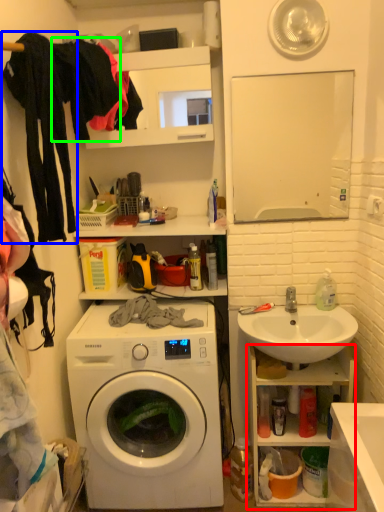
Question: Based on their relative distances, which object is nearer to cabinet (highlighted by a red box)? Choose from clothing (highlighted by a blue box) and clothing (highlighted by a green box).

Choices:
 (A) clothing
 (B) clothing

Answer: (A)